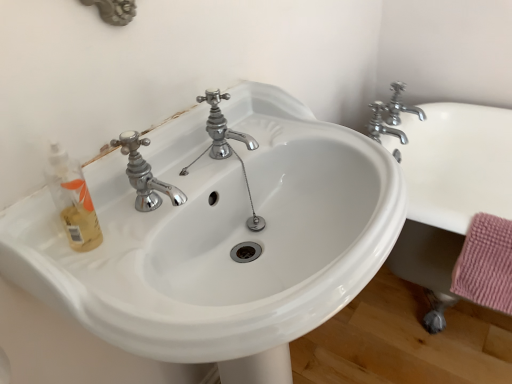
Question: Which is correct: chrome metallic faucet at upper right, the 1th tap viewed from the left, is inside chrome metallic faucet at upper right, acting as the first tap starting from the right, or outside of it?

Choices:
 (A) inside
 (B) outside

Answer: (B)

Question: Is point click(x=404, y=139) positioned closer to the camera than point click(x=396, y=105)?

Choices:
 (A) closer
 (B) farther

Answer: (A)

Question: Which object is the closest to the chrome metallic faucet at upper right, acting as the first tap starting from the right?

Choices:
 (A) chrome metallic faucet at upper right, the 1th tap viewed from the left
 (B) white ceramic bath at right
 (C) white glossy sink at center

Answer: (A)

Question: Considering the real-world distances, which object is closest to the white glossy sink at center?

Choices:
 (A) chrome metallic faucet at upper right, acting as the 2th tap starting from the left
 (B) white ceramic bath at right
 (C) chrome metallic faucet at upper right, the 1th tap viewed from the left

Answer: (C)